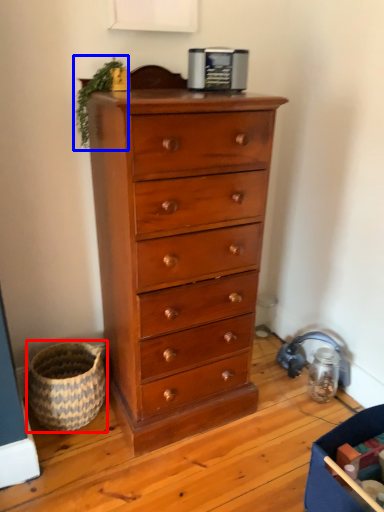
Question: Which object appears closest to the camera in this image, basket (highlighted by a red box) or plant (highlighted by a blue box)?

Choices:
 (A) basket
 (B) plant

Answer: (B)